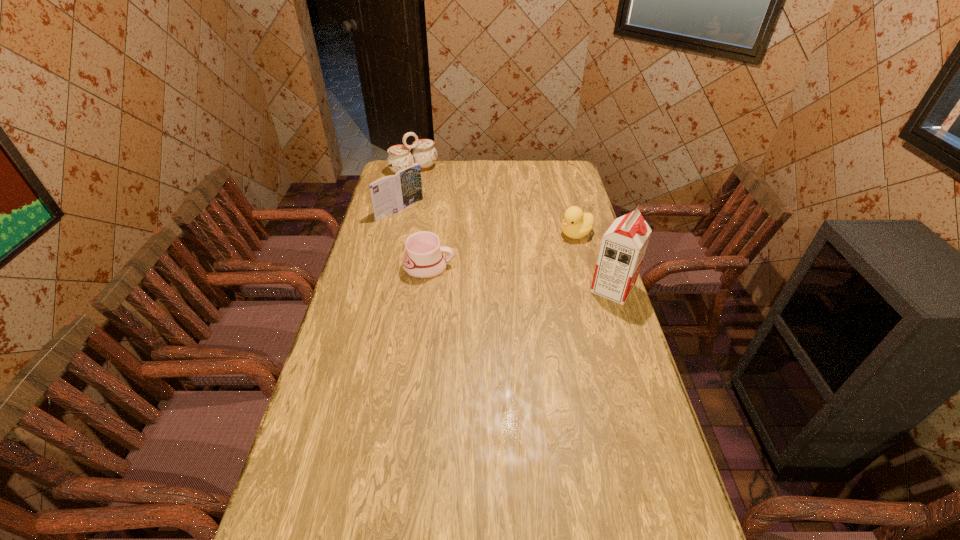
At what (x,y) coordinates should I click in order to perform the action: click on soya milk at the right edge. Please return your answer as a coordinate pair (x, y). Image resolution: width=960 pixels, height=540 pixels. Looking at the image, I should click on (623, 246).

Find the location of a particular element. duck that is at the right edge is located at coordinates (576, 224).

This screenshot has width=960, height=540. I want to click on object located at the far left corner, so click(x=424, y=153).

You are a GUI agent. You are given a task and a screenshot of the screen. Output one action in this format:
    pyautogui.click(x=<x>, y=<y>)
    Task: Click on the free space at the far edge
    Image resolution: width=960 pixels, height=540 pixels.
    Given the screenshot: What is the action you would take?
    pyautogui.click(x=452, y=167)

Locate an element on the screen. free space at the left edge is located at coordinates (345, 422).

Locate an element on the screen. This screenshot has height=540, width=960. free space at the right edge of the desktop is located at coordinates (616, 370).

I want to click on free space between the fourth tallest object and the soya milk, so click(594, 261).

At what (x,y) coordinates should I click in order to perform the action: click on empty space between the chinaware and the tallest object. Please return your answer as a coordinate pair (x, y). The image size is (960, 540). Looking at the image, I should click on (514, 229).

Locate an element on the screen. The image size is (960, 540). free space between the second shortest object and the second farthest object is located at coordinates (489, 222).

Identify the location of empty space between the shortest object and the soya milk. This screenshot has height=540, width=960. (520, 278).